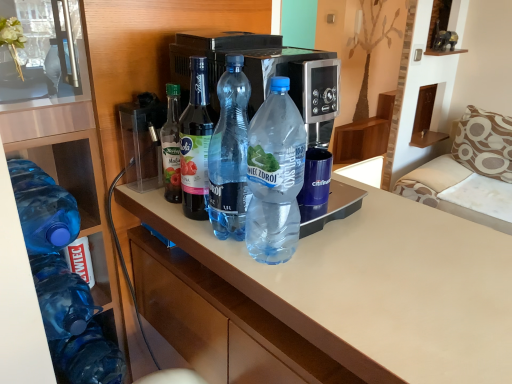
What are the coordinates of `vacant region to the left of blue translucent bottle at center, which is counted as the 5th bottle, starting from the left` in the screenshot? It's located at (209, 244).